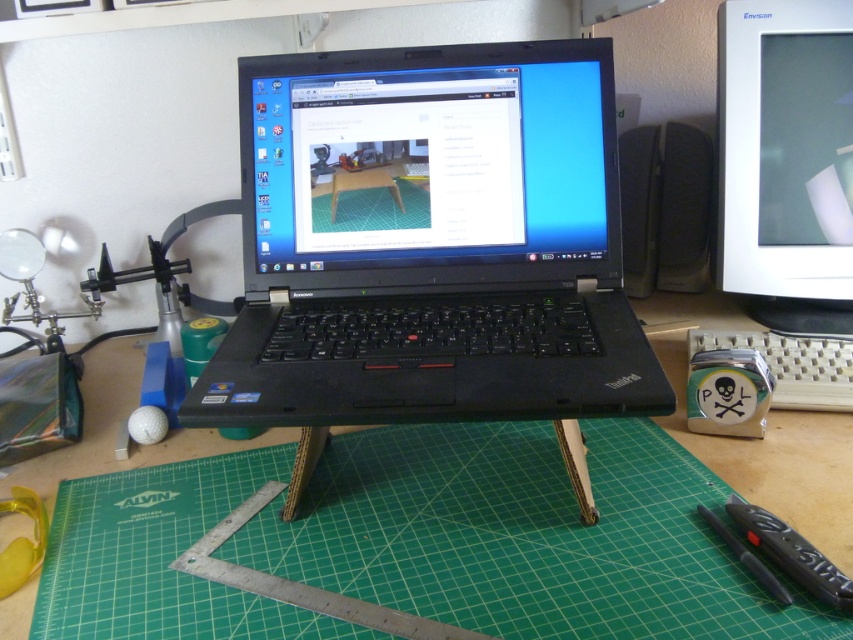
You have a rectangular object that is 20 cm wide. You want to place it on either the black plastic laptop at center or the green cutting mat at center. Which surface can it fit on without overhanging?

The black plastic laptop at center has a larger width than the green cutting mat at center. Since the rectangular object is 20 cm wide, it can fit on the black plastic laptop at center if its width accommodates 20 cm, but the green cutting mat at center may be narrower. However, without knowing the exact dimensions of both surfaces, we can only infer based on the given information that the laptop is wider. Therefore, the object is more likely to fit on the black plastic laptop at center.

You are setting up a workspace and need to place the black plastic laptop at center on the desk. The desk has a green cutting mat at center. Can the laptop be placed directly on the mat without any stand?

The black plastic laptop at center is currently above the green cutting mat at center, which suggests that it is elevated by the stand. If the stand is removed, the laptop would rest directly on the mat, but the description does not specify if the mat is large enough or if there are other constraints. However, based on the given information, the laptop can be placed directly on the mat since it is already positioned above it, implying spatial compatibility.

You are setting up a new monitor and need to place it on your desk. You currently have a white glossy monitor at upper right and a green cutting mat at center. Which object should you move to make space?

The green cutting mat at center is behind the white glossy monitor at upper right, so you should move the green cutting mat at center to make space for the new monitor.